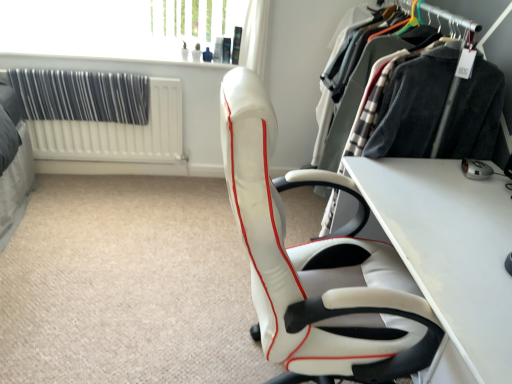
Identify the location of free spot to the right of silver metallic mouse at lower right. The image size is (512, 384). (499, 173).